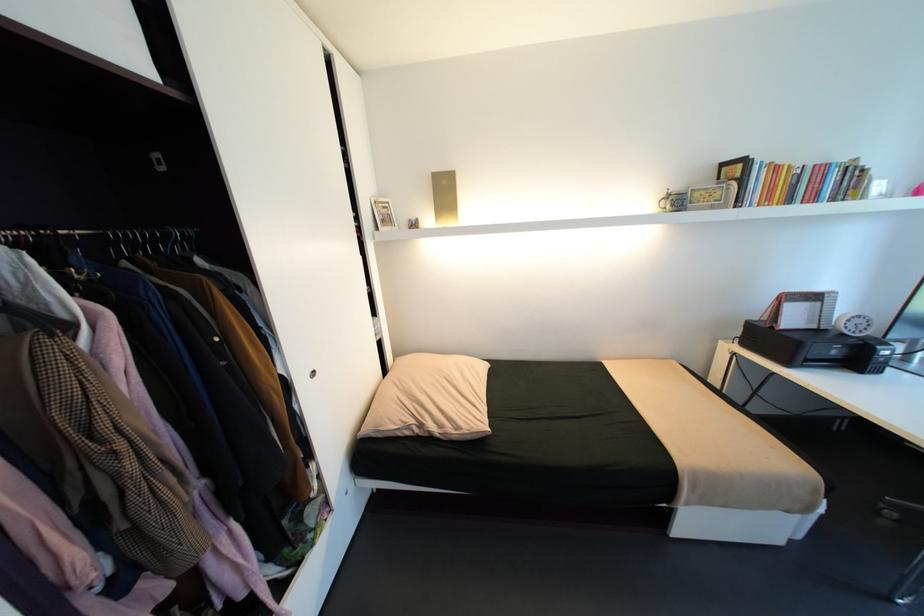
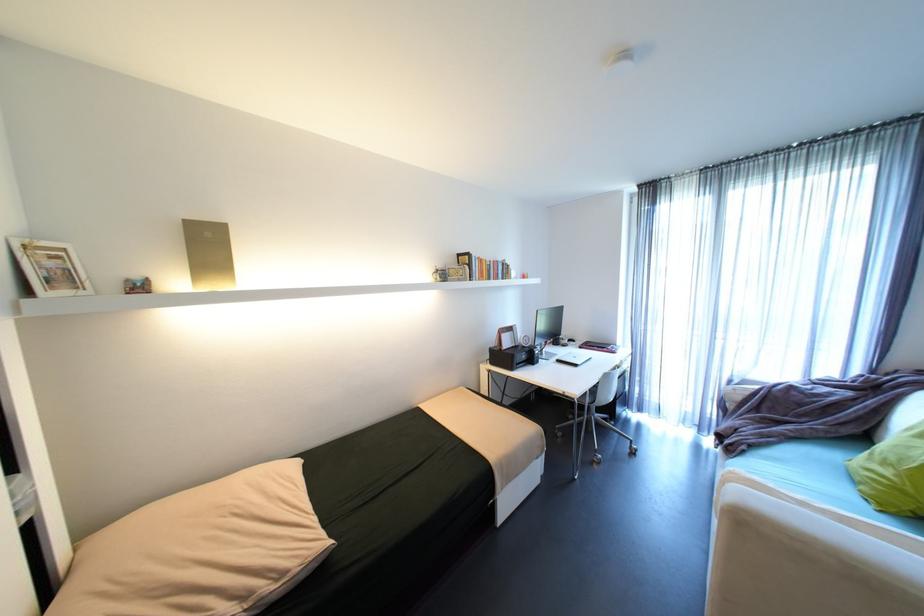
The point at (466, 428) is marked in the first image. Where is the corresponding point in the second image?

(289, 575)